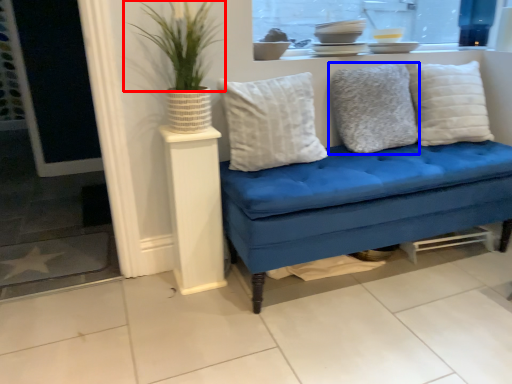
Question: Which of the following is the closest to the observer, plant (highlighted by a red box) or pillow (highlighted by a blue box)?

Choices:
 (A) plant
 (B) pillow

Answer: (A)